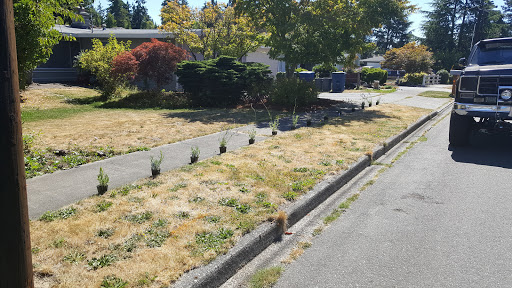
Locate an element on the screen. homes is located at coordinates (59, 58), (368, 58), (273, 61).